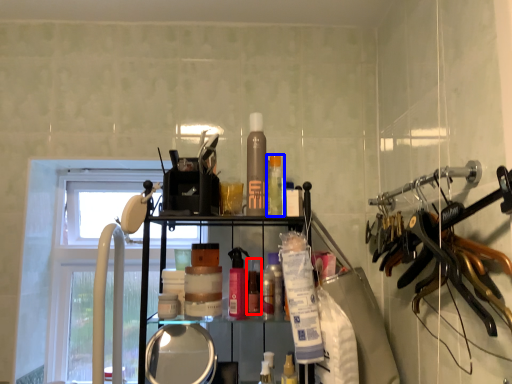
Question: Which object appears closest to the camera in this image, toiletry (highlighted by a red box) or toiletry (highlighted by a blue box)?

Choices:
 (A) toiletry
 (B) toiletry

Answer: (B)